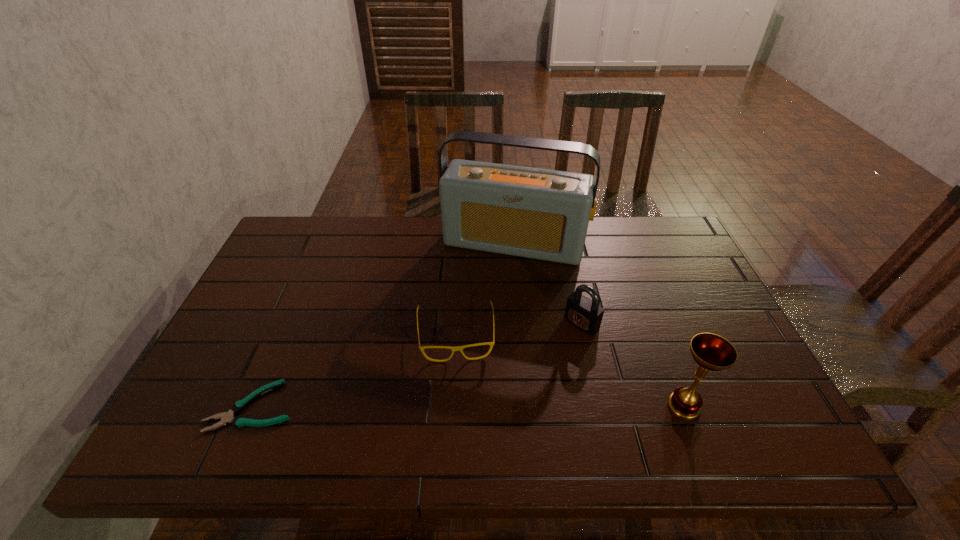
The height and width of the screenshot is (540, 960). Find the location of `vacant space on the desktop that is between the pliers and the second tallest object and is positioned on the front-facing side of the tallest object`. vacant space on the desktop that is between the pliers and the second tallest object and is positioned on the front-facing side of the tallest object is located at coordinates (464, 406).

You are a GUI agent. You are given a task and a screenshot of the screen. Output one action in this format:
    pyautogui.click(x=<x>, y=<y>)
    Task: Click on the vacant space on the desktop that is between the leftmost object and the rightmost object and is positioned in front of the lenses of the spectacles
    The width and height of the screenshot is (960, 540).
    Given the screenshot: What is the action you would take?
    pyautogui.click(x=459, y=406)

Where is `vacant spot on the desktop that is between the leftmost object and the rightmost object and is positioned on the front of the third shortest object near the keyhole`? Image resolution: width=960 pixels, height=540 pixels. vacant spot on the desktop that is between the leftmost object and the rightmost object and is positioned on the front of the third shortest object near the keyhole is located at coordinates (490, 406).